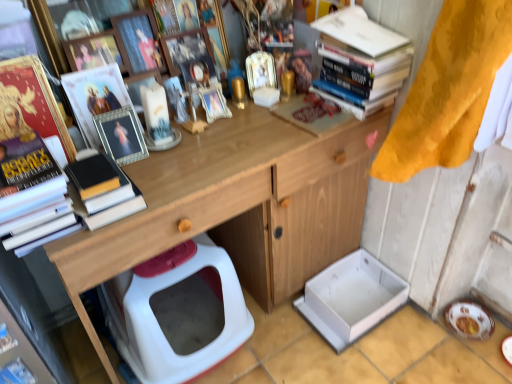
Where is `vacant area that lies to the right of white plastic toilet at lower center`? The height and width of the screenshot is (384, 512). vacant area that lies to the right of white plastic toilet at lower center is located at coordinates (290, 344).